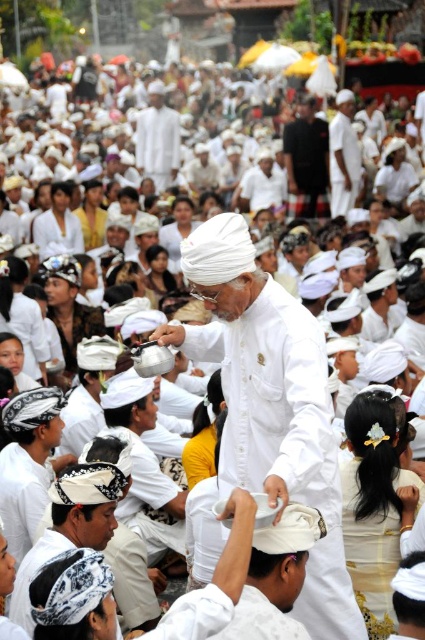
Question: Among these objects, which one is nearest to the camera?

Choices:
 (A) white cotton turban at center
 (B) white matte shirt at center
 (C) black matte shirt at center

Answer: (B)

Question: Which point is farther to the camera?

Choices:
 (A) (200, 234)
 (B) (73, 472)
 (C) (348, 108)

Answer: (C)

Question: Does white woven turban at center appear on the right side of black matte shirt at center?

Choices:
 (A) no
 (B) yes

Answer: (A)

Question: Does white woven turban at center appear under white cotton turban at center?

Choices:
 (A) yes
 (B) no

Answer: (A)

Question: Is the position of white woven turban at center less distant than that of black matte shirt at center?

Choices:
 (A) yes
 (B) no

Answer: (A)

Question: Which point is farther to the camera?

Choices:
 (A) white cotton turban at center
 (B) black matte shirt at center
 (C) white woven turban at center
 (D) white matte shirt at center

Answer: (A)